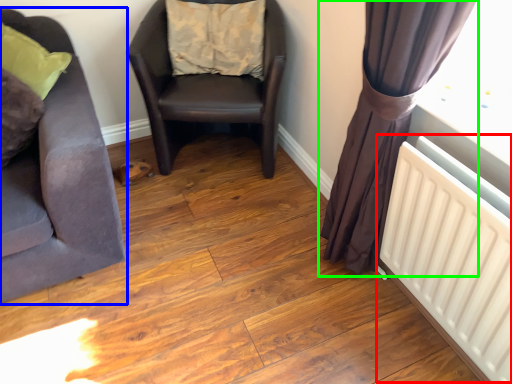
Question: Based on their relative distances, which object is nearer to radiator (highlighted by a red box)? Choose from chair (highlighted by a blue box) and curtain (highlighted by a green box).

Choices:
 (A) chair
 (B) curtain

Answer: (B)